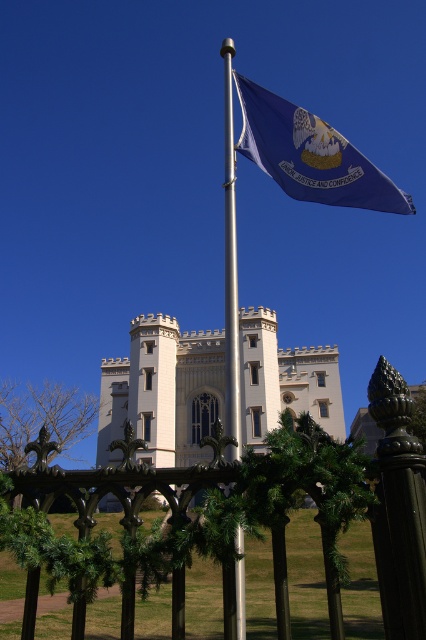
Question: Does white stone palace at center come in front of blue fabric flag at upper center?

Choices:
 (A) no
 (B) yes

Answer: (A)

Question: Which point is farther to the camera?

Choices:
 (A) white stone palace at center
 (B) blue fabric flag at upper center

Answer: (A)

Question: Does white stone palace at center have a smaller size compared to silver metallic flag pole at center?

Choices:
 (A) yes
 (B) no

Answer: (B)

Question: Is blue fabric flag at upper center positioned behind silver metallic flag pole at center?

Choices:
 (A) yes
 (B) no

Answer: (A)

Question: Which of the following is the farthest from the observer?

Choices:
 (A) (224, 582)
 (B) (302, 156)

Answer: (B)

Question: Which point is closer to the camera?

Choices:
 (A) white stone palace at center
 (B) silver metallic flag pole at center

Answer: (B)